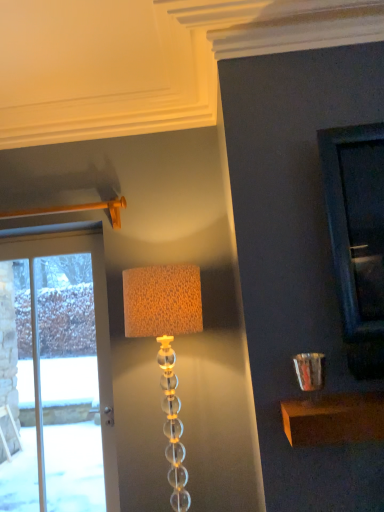
Where is `free space above white glass door at left (from a real-world perspective)`? The width and height of the screenshot is (384, 512). free space above white glass door at left (from a real-world perspective) is located at coordinates (40, 234).